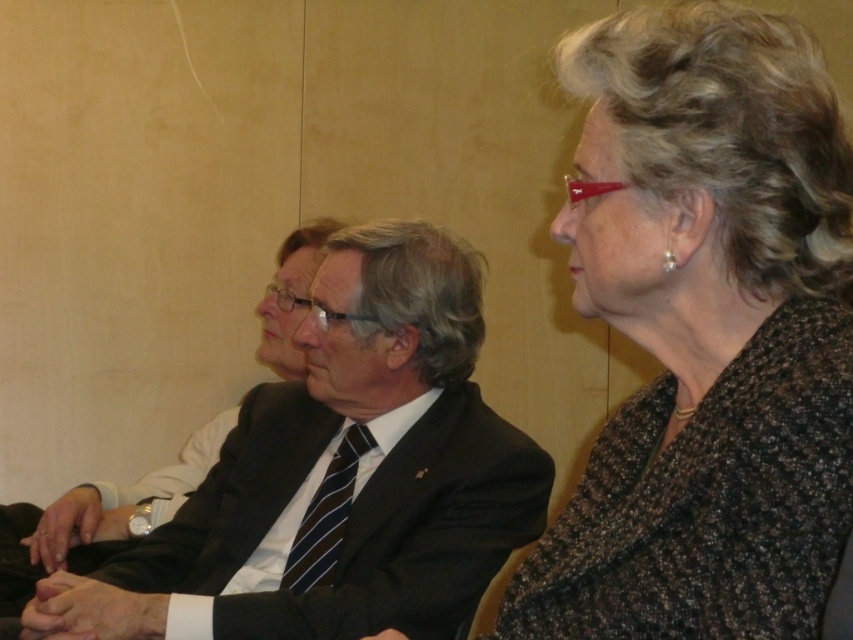
Question: Is dark suit at center below dark blue striped tie at center?

Choices:
 (A) no
 (B) yes

Answer: (A)

Question: Does speckled woolen sweater at right lie in front of dark suit at center?

Choices:
 (A) yes
 (B) no

Answer: (A)

Question: Which point is closer to the camera?

Choices:
 (A) smooth skin hands at center
 (B) dark suit at center
 (C) speckled woolen sweater at right

Answer: (C)

Question: Which of the following is the closest to the observer?

Choices:
 (A) dark blue striped tie at center
 (B) smooth skin hands at center
 (C) dark suit at center
 (D) speckled woolen sweater at right

Answer: (D)

Question: Estimate the real-world distances between objects in this image. Which object is closer to the speckled woolen sweater at right?

Choices:
 (A) smooth skin hands at center
 (B) dark suit at center

Answer: (B)

Question: Can you confirm if speckled woolen sweater at right is smaller than dark suit at center?

Choices:
 (A) no
 (B) yes

Answer: (B)